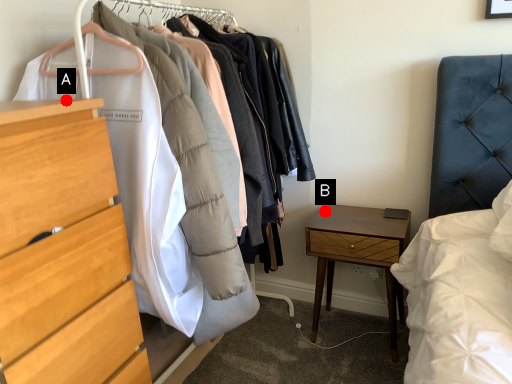
Question: Two points are circled on the image, labeled by A and B beside each circle. Among these points, which one is farthest from the camera?

Choices:
 (A) A is further
 (B) B is further

Answer: (B)